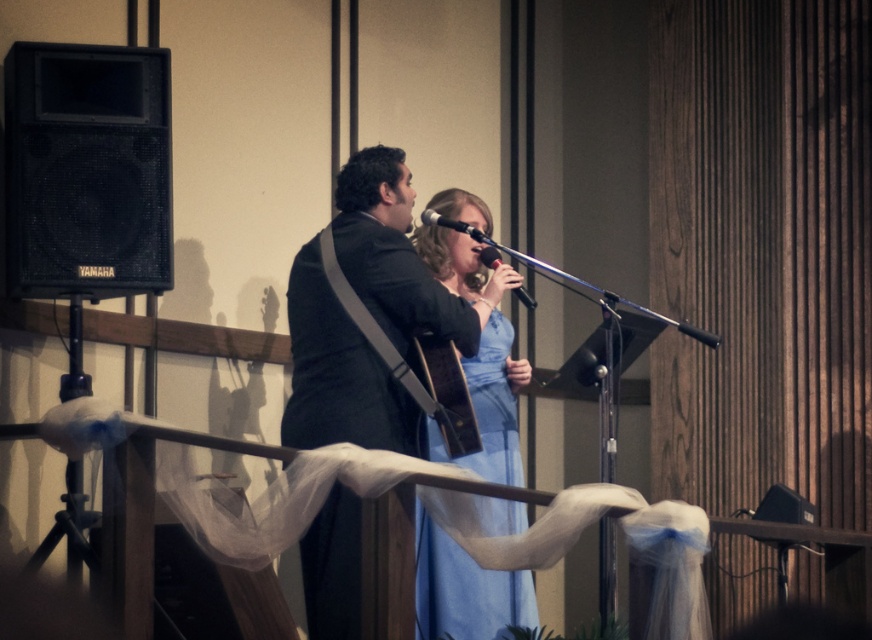
You are a stagehand who needs to adjust the microphone stand between the dark gray suit at center and the black mesh speaker at left. Based on their positions, which object is closer to the front of the stage?

The dark gray suit at center is closer to the front of the stage because it is positioned under the black mesh speaker at left, indicating it is in a lower, more forward position.